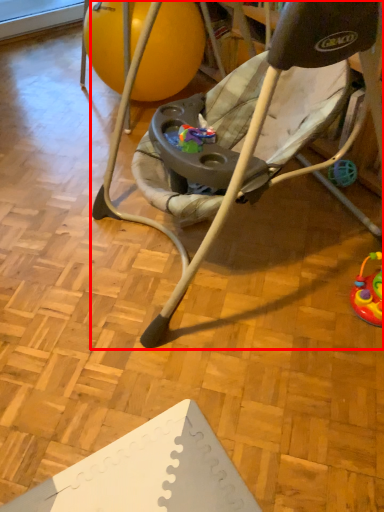
Question: Where is chair (annotated by the red box) located in relation to ball in the image?

Choices:
 (A) right
 (B) left

Answer: (A)